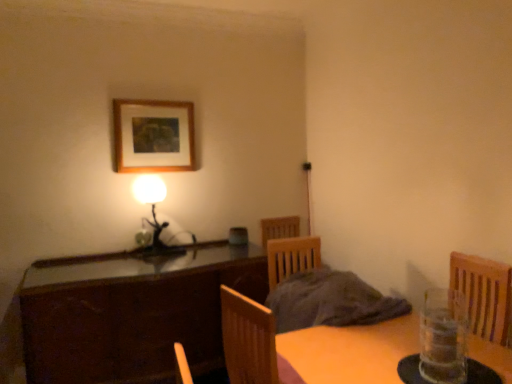
This screenshot has width=512, height=384. Find the location of `clear glass vase at lower right`. clear glass vase at lower right is located at coordinates (443, 337).

What is the approximate width of wooden picture frame at upper center?

The width of wooden picture frame at upper center is 1.59 inches.

In order to click on clear glass vase at lower right in this screenshot , I will do `click(443, 337)`.

Who is smaller, clear glass vase at lower right or wooden picture frame at upper center?

Smaller between the two is clear glass vase at lower right.

From a real-world perspective, relative to wooden picture frame at upper center, is clear glass vase at lower right vertically above or below?

In terms of real-world spatial position, clear glass vase at lower right is below wooden picture frame at upper center.

Which is in front, clear glass vase at lower right or wooden picture frame at upper center?

clear glass vase at lower right is closer to the camera.

Image resolution: width=512 pixels, height=384 pixels. I want to click on picture frame above the clear glass vase at lower right (from the image's perspective), so click(x=153, y=136).

Find the location of a particular element. The image size is (512, 384). glass vase that appears in front of the dark wood cabinet at center is located at coordinates (443, 337).

Consider the image. From a real-world perspective, which object stands above the other?

In real-world perspective, clear glass vase at lower right is above.

Who is taller, matte black lamp at left or wooden picture frame at upper center?

matte black lamp at left is taller.

Does matte black lamp at left appear on the right side of wooden picture frame at upper center?

Yes.

Could you tell me if matte black lamp at left is facing wooden picture frame at upper center?

No, matte black lamp at left does not turn towards wooden picture frame at upper center.

What's the angular difference between matte black lamp at left and wooden picture frame at upper center's facing directions?

There is a 2-degree angle between the facing directions of matte black lamp at left and wooden picture frame at upper center.

From a real-world perspective, is dark wood cabinet at center under wooden picture frame at upper center?

Yes, from a real-world perspective, dark wood cabinet at center is beneath wooden picture frame at upper center.

Which object is thinner, dark wood cabinet at center or wooden picture frame at upper center?

Thinner between the two is wooden picture frame at upper center.

Considering the positions of points (53, 282) and (175, 108), is point (53, 282) closer to camera compared to point (175, 108)?

That is True.

From the image's perspective, who appears lower, dark wood cabinet at center or wooden picture frame at upper center?

dark wood cabinet at center.

Choose the correct answer: Is matte black lamp at left inside dark wood cabinet at center or outside it?

matte black lamp at left is located beyond the bounds of dark wood cabinet at center.

Is matte black lamp at left facing away from dark wood cabinet at center?

No.

Is point (140, 182) closer to camera compared to point (223, 253)?

No, it is not.

From the image's perspective, would you say matte black lamp at left is positioned over dark wood cabinet at center?

Yes, from the image's perspective, matte black lamp at left is above dark wood cabinet at center.

Between wooden picture frame at upper center and dark wood cabinet at center, which one has less height?

Standing shorter between the two is wooden picture frame at upper center.

Is wooden picture frame at upper center further to camera compared to dark wood cabinet at center?

Yes, wooden picture frame at upper center is further from the viewer.

Image resolution: width=512 pixels, height=384 pixels. What are the coordinates of `picture frame on the left of dark wood cabinet at center` in the screenshot? It's located at (153, 136).

Does dark wood cabinet at center have a smaller size compared to matte black lamp at left?

No, dark wood cabinet at center is not smaller than matte black lamp at left.

Is point (182, 275) farther from viewer compared to point (159, 225)?

No, it is not.

Which object is closer to the camera, dark wood cabinet at center or matte black lamp at left?

dark wood cabinet at center is closer to the camera.

Which is more to the right, dark wood cabinet at center or matte black lamp at left?

dark wood cabinet at center.

Find the location of `picture frame behind the clear glass vase at lower right`. picture frame behind the clear glass vase at lower right is located at coordinates (153, 136).

The height and width of the screenshot is (384, 512). Identify the location of glass vase in front of the dark wood cabinet at center. (443, 337).

Looking at the image, which one is located further to matte black lamp at left, wooden picture frame at upper center or clear glass vase at lower right?

Based on the image, clear glass vase at lower right appears to be further to matte black lamp at left.

From the image, which object appears to be nearer to matte black lamp at left, clear glass vase at lower right or wooden picture frame at upper center?

wooden picture frame at upper center.

Estimate the real-world distances between objects in this image. Which object is further from wooden picture frame at upper center, matte black lamp at left or dark wood cabinet at center?

dark wood cabinet at center lies further to wooden picture frame at upper center than the other object.

Consider the image. Based on their spatial positions, is matte black lamp at left or wooden picture frame at upper center further from dark wood cabinet at center?

wooden picture frame at upper center.

Consider the image. Estimate the real-world distances between objects in this image. Which object is further from dark wood cabinet at center, wooden picture frame at upper center or matte black lamp at left?

wooden picture frame at upper center is further to dark wood cabinet at center.

Considering their positions, is dark wood cabinet at center positioned further to clear glass vase at lower right than matte black lamp at left?

The object further to clear glass vase at lower right is matte black lamp at left.

Looking at the image, which one is located further to wooden picture frame at upper center, dark wood cabinet at center or clear glass vase at lower right?

clear glass vase at lower right is positioned further to the anchor wooden picture frame at upper center.

Looking at this image, from the image, which object appears to be nearer to clear glass vase at lower right, matte black lamp at left or dark wood cabinet at center?

The object closer to clear glass vase at lower right is dark wood cabinet at center.

At what (x,y) coordinates should I click in order to perform the action: click on cabinetry situated between matte black lamp at left and clear glass vase at lower right from left to right. Please return your answer as a coordinate pair (x, y). This screenshot has height=384, width=512. Looking at the image, I should click on (131, 313).

The image size is (512, 384). In order to click on cabinetry situated between wooden picture frame at upper center and clear glass vase at lower right from left to right in this screenshot , I will do `click(131, 313)`.

Find the location of a particular element. table lamp between wooden picture frame at upper center and dark wood cabinet at center in the vertical direction is located at coordinates (152, 206).

Locate an element on the screen. The width and height of the screenshot is (512, 384). table lamp between clear glass vase at lower right and wooden picture frame at upper center in the front-back direction is located at coordinates (152, 206).